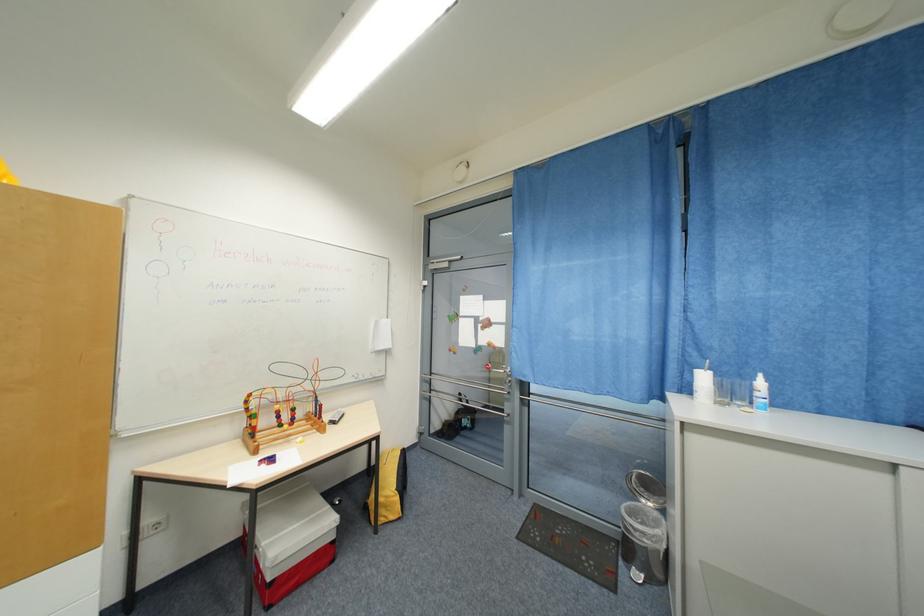
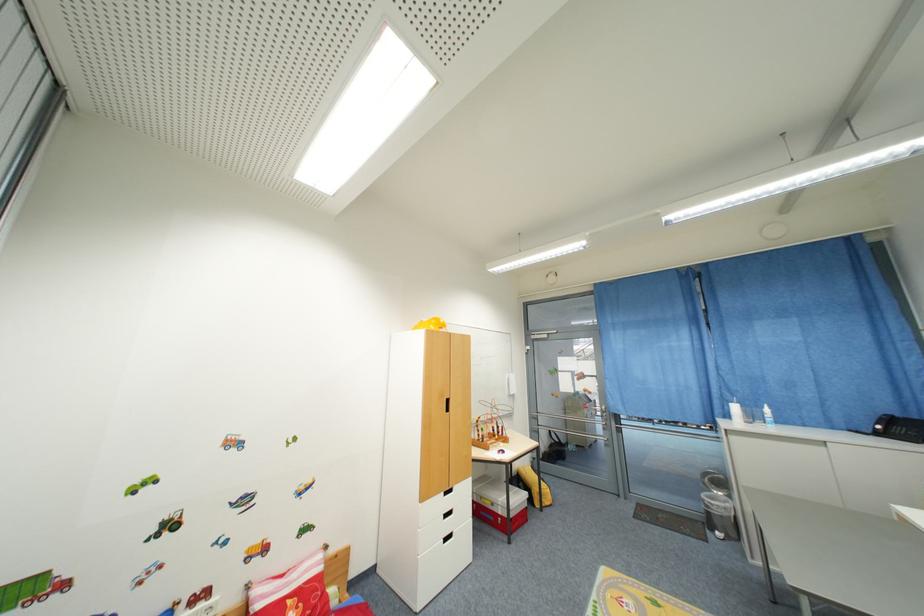
Locate, in the second image, the point that corresponds to point 463,415 in the first image.

(555, 448)